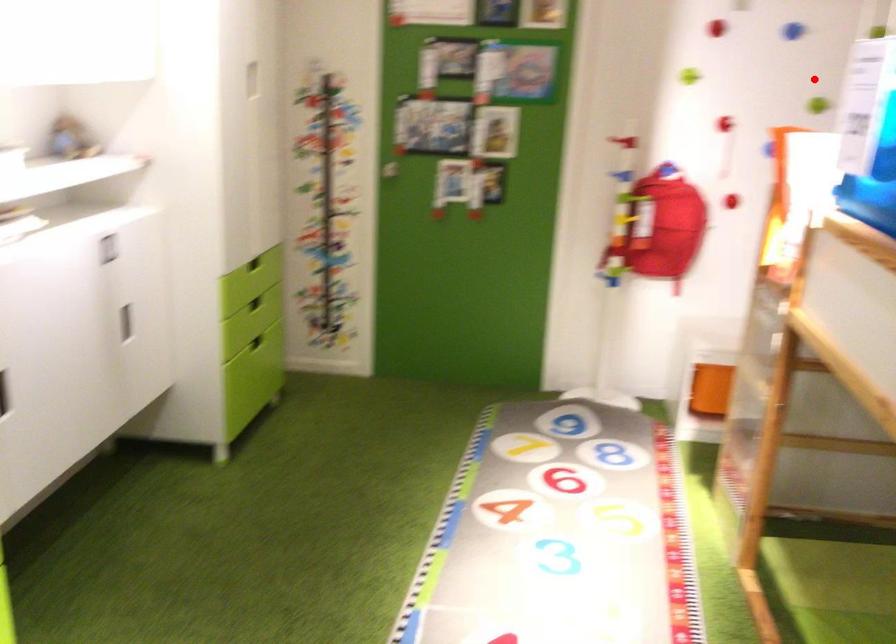
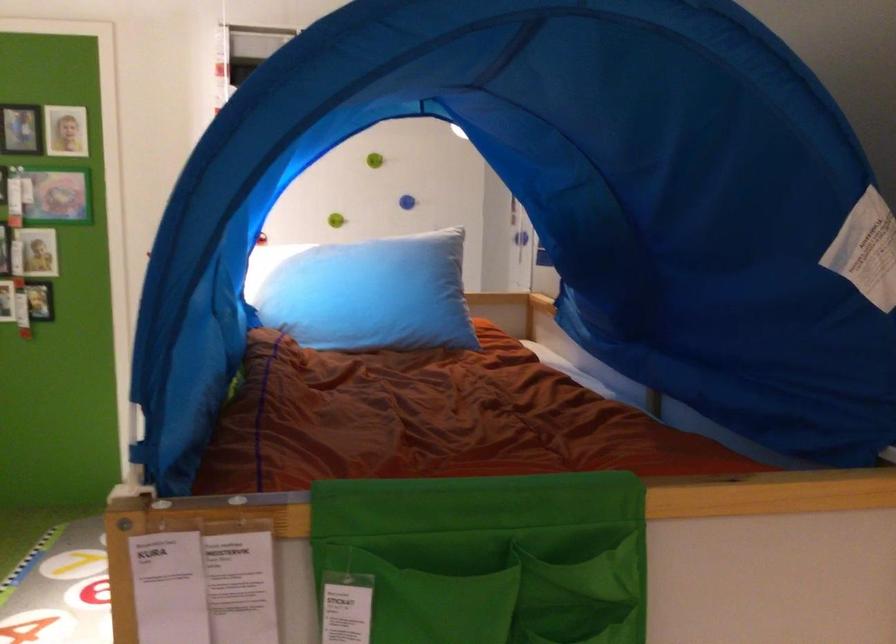
In the second image, find the point that corresponds to the highlighted location in the first image.

(334, 220)